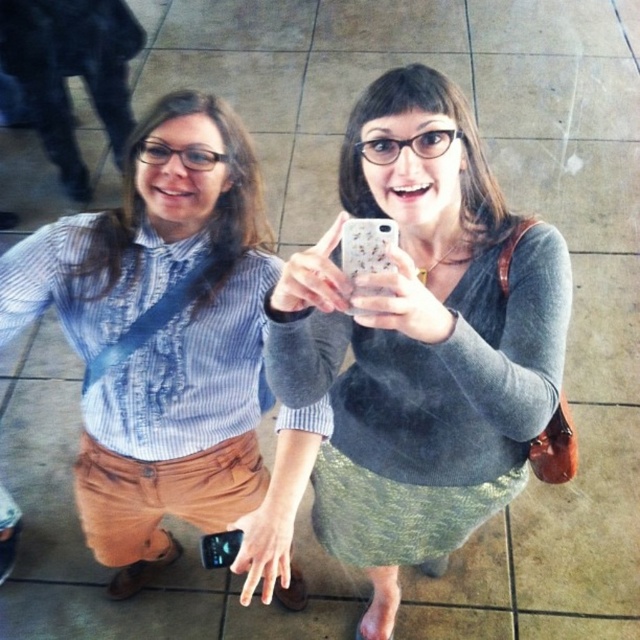
Question: Is gray wool sweater at center above blue striped shirt at center?

Choices:
 (A) no
 (B) yes

Answer: (B)

Question: From the image, what is the correct spatial relationship of gray wool sweater at center in relation to blue striped shirt at center?

Choices:
 (A) above
 (B) below

Answer: (A)

Question: Which point is closer to the camera?

Choices:
 (A) blue striped shirt at center
 (B) gray wool sweater at center

Answer: (B)

Question: Can you confirm if gray wool sweater at center is thinner than blue striped shirt at center?

Choices:
 (A) no
 (B) yes

Answer: (B)

Question: Which object appears farthest from the camera in this image?

Choices:
 (A) blue striped shirt at center
 (B) gray wool sweater at center

Answer: (A)